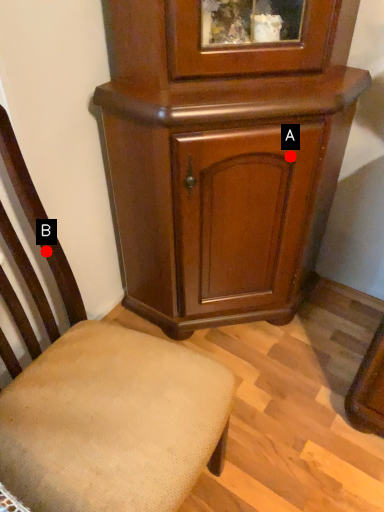
Question: Two points are circled on the image, labeled by A and B beside each circle. Among these points, which one is nearest to the camera?

Choices:
 (A) A is closer
 (B) B is closer

Answer: (B)